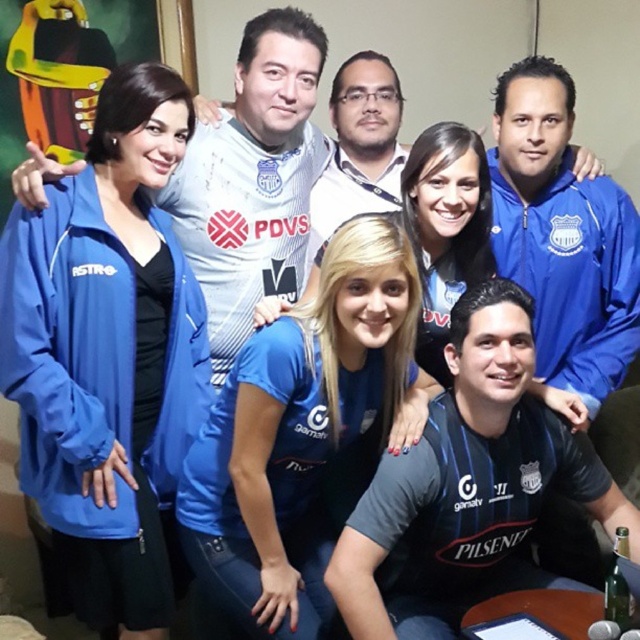
Is blue jersey at center below blue fabric jacket at upper right?

Yes, blue jersey at center is below blue fabric jacket at upper right.

Between blue jersey at center and blue fabric jacket at upper right, which one is positioned lower?

blue jersey at center is below.

Between point (401, 292) and point (593, 252), which one is positioned behind?

The point (593, 252) is behind.

The height and width of the screenshot is (640, 640). I want to click on blue jersey at center, so coord(300,432).

What are the coordinates of `blue fabric jacket at left` in the screenshot? It's located at [108, 353].

Who is shorter, blue fabric jacket at left or matte white jersey at upper center?

matte white jersey at upper center

Does point (112, 90) lie behind point (294, 81)?

That is False.

Identify the location of blue fabric jacket at left. This screenshot has width=640, height=640. (108, 353).

Is blue jersey at center wider than dark gray jersey at lower center?

No.

Is blue jersey at center bigger than dark gray jersey at lower center?

Correct, blue jersey at center is larger in size than dark gray jersey at lower center.

Describe the element at coordinates (300, 432) in the screenshot. I see `blue jersey at center` at that location.

The width and height of the screenshot is (640, 640). In order to click on blue jersey at center in this screenshot , I will do `click(300, 432)`.